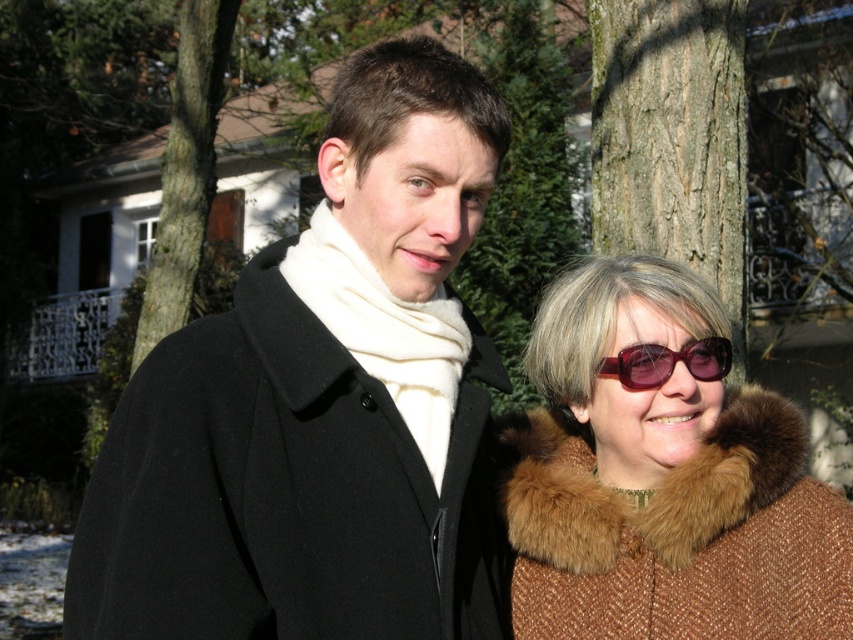
What is the location of the brown textured bark at upper left in the image?

The brown textured bark at upper left is located at point (186, 170).

You are a photographer trying to capture a closeup of the brown textured bark at upper left and the burgundy plastic sunglasses at right. Which object should you focus on first if you want to ensure both are in focus without moving the camera?

The brown textured bark at upper left is wider than the burgundy plastic sunglasses at right, so you should focus on the wider object first to ensure both are in focus.

You are standing in front of the house and see two points in the image. The first point is at coordinate point [706,93] and the second is at point [158,298]. Which point is closer to you?

Point [706,93] is closer to the viewer than point [158,298].